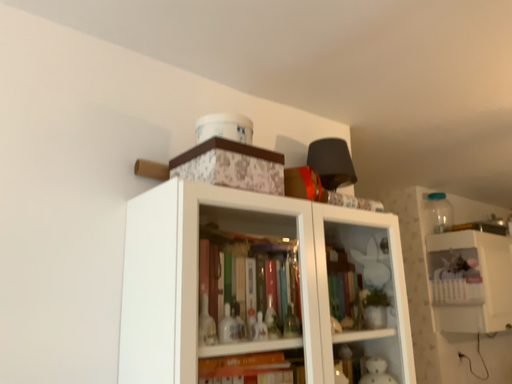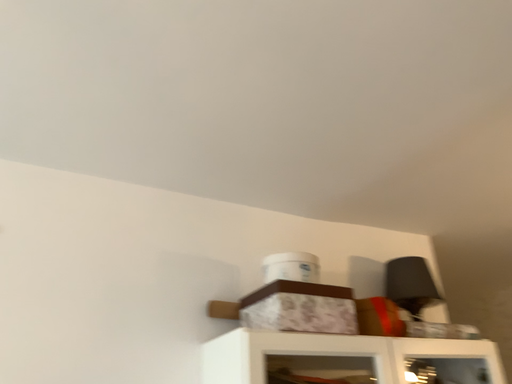
Question: How did the camera likely rotate when shooting the video?

Choices:
 (A) rotated upward
 (B) rotated downward

Answer: (A)